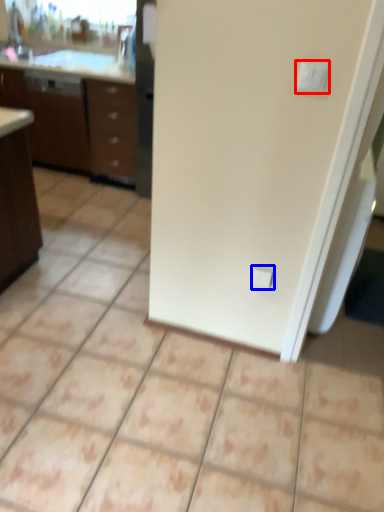
Question: Which of the following is the closest to the observer, light switch (highlighted by a red box) or electric outlet (highlighted by a blue box)?

Choices:
 (A) light switch
 (B) electric outlet

Answer: (A)